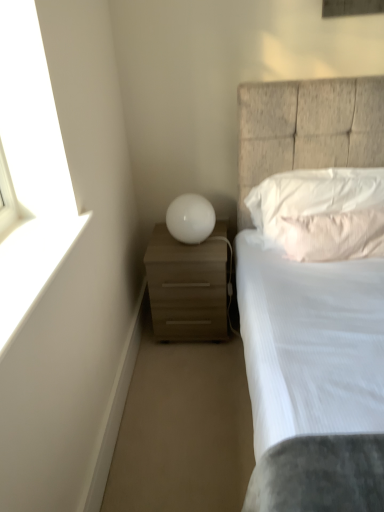
The height and width of the screenshot is (512, 384). I want to click on vacant region above white matte window sill at upper left (from a real-world perspective), so click(x=33, y=249).